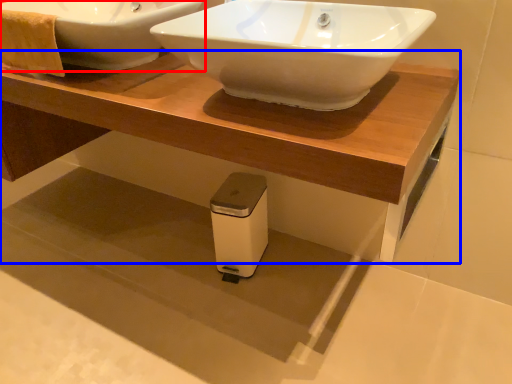
Question: Which point is further to the camera, sink (highlighted by a red box) or table (highlighted by a blue box)?

Choices:
 (A) sink
 (B) table

Answer: (A)